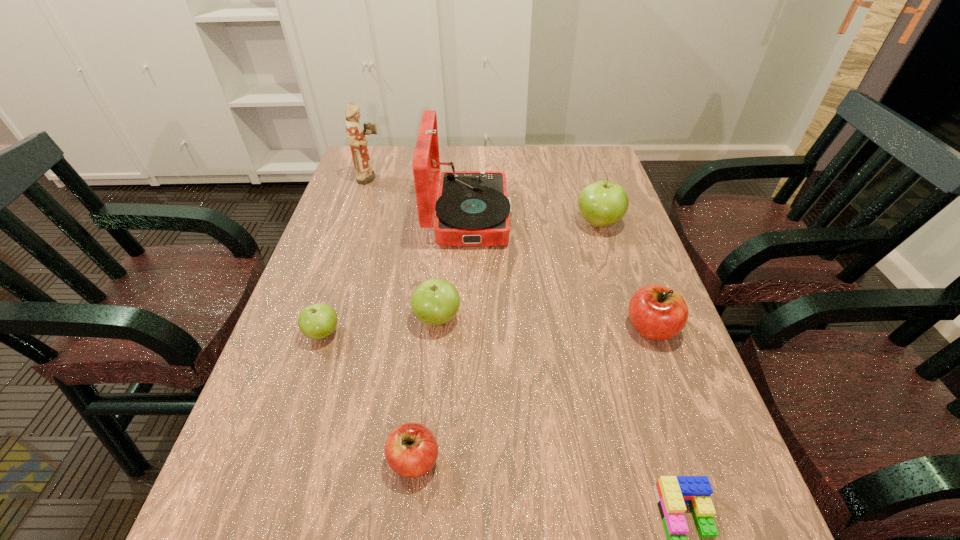
This screenshot has height=540, width=960. What are the coordinates of `apple that is at the left edge` in the screenshot? It's located at pyautogui.click(x=317, y=321).

Locate an element on the screen. The width and height of the screenshot is (960, 540). object that is at the far left corner is located at coordinates (356, 136).

The width and height of the screenshot is (960, 540). In order to click on blank space at the far edge of the desktop in this screenshot , I will do `click(523, 149)`.

Where is `free spot at the left edge of the desktop`? This screenshot has height=540, width=960. free spot at the left edge of the desktop is located at coordinates (237, 491).

What are the coordinates of `free space at the right edge` in the screenshot? It's located at (619, 399).

You are a GUI agent. You are given a task and a screenshot of the screen. Output one action in this format:
    pyautogui.click(x=<x>, y=<y>)
    Task: Click on the blank region between the leftmost green apple and the farthest object
    This screenshot has height=540, width=960.
    Given the screenshot: What is the action you would take?
    pyautogui.click(x=347, y=256)

In order to click on free space that is in between the leftmost apple and the second green apple from right to left in this screenshot , I will do `click(380, 326)`.

Where is `vacant region between the third tallest object and the leftmost green apple`? vacant region between the third tallest object and the leftmost green apple is located at coordinates (461, 278).

Find the location of `vacant space in between the second green apple from right to left and the farthest apple`. vacant space in between the second green apple from right to left and the farthest apple is located at coordinates (517, 271).

Locate an element on the screen. The image size is (960, 540). empty space between the second smallest green apple and the right red apple is located at coordinates (544, 323).